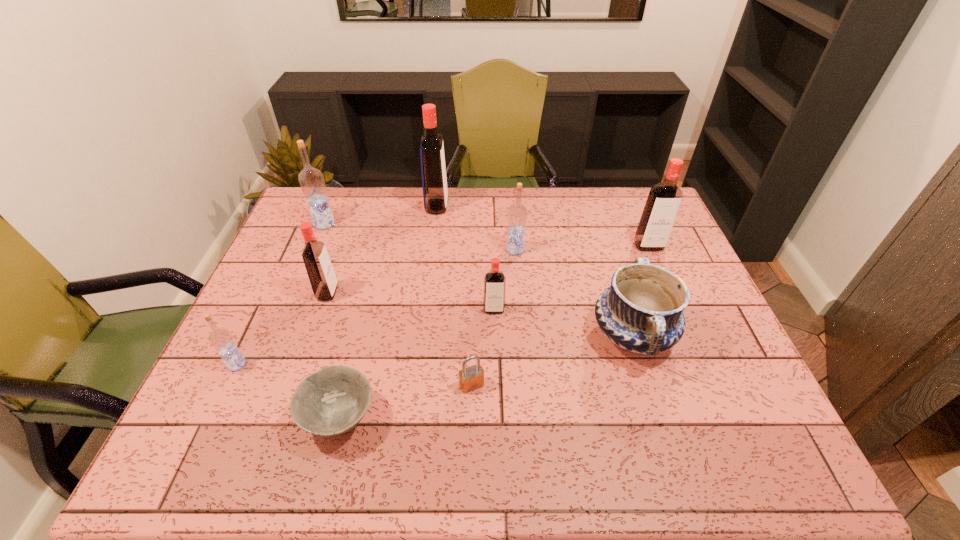
Identify the location of the farthest object. (435, 194).

At what (x,y) coordinates should I click in order to perform the action: click on the second red vodka from left to right. Please return your answer as a coordinate pair (x, y). This screenshot has height=540, width=960. Looking at the image, I should click on (435, 194).

Find the location of `the farthest blue vodka`. the farthest blue vodka is located at coordinates (311, 180).

The image size is (960, 540). I want to click on the second farthest vodka, so click(311, 180).

Locate an element on the screen. Image resolution: width=960 pixels, height=540 pixels. the second biggest red vodka is located at coordinates (663, 202).

At what (x,y) coordinates should I click in order to perform the action: click on the rightmost red vodka. Please return your answer as a coordinate pair (x, y). This screenshot has height=540, width=960. Looking at the image, I should click on (663, 202).

The image size is (960, 540). I want to click on the second smallest red vodka, so click(321, 274).

Locate an element on the screen. Image resolution: width=960 pixels, height=540 pixels. the third object from left to right is located at coordinates (321, 274).

You are a GUI agent. You are given a task and a screenshot of the screen. Output one action in this format:
    pyautogui.click(x=<x>, y=<y>)
    Task: Click on the second farthest blue vodka
    The image size is (960, 540).
    Given the screenshot: What is the action you would take?
    pyautogui.click(x=517, y=214)

Where is `the rightmost blue vodka`? the rightmost blue vodka is located at coordinates (517, 214).